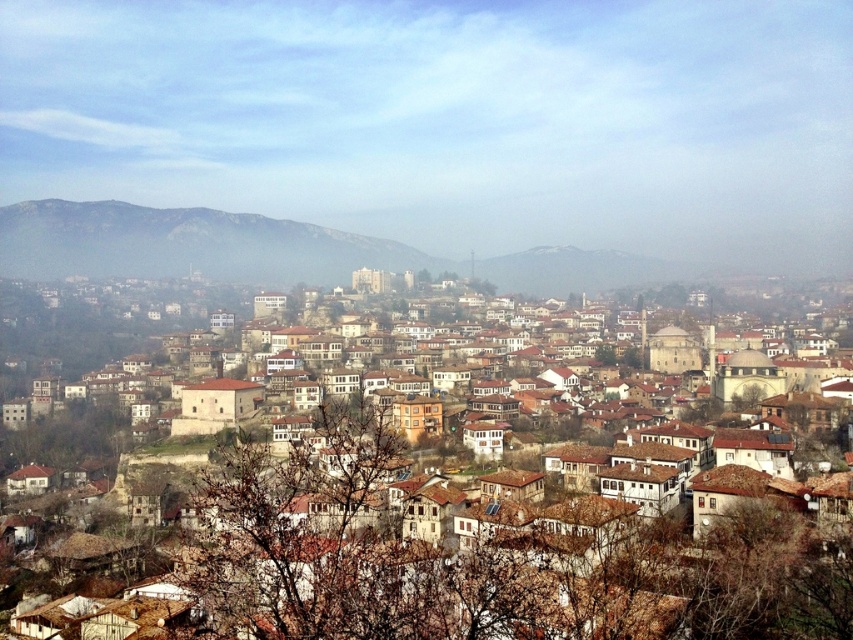
Between point (511, 545) and point (4, 269), which one is positioned behind?

Point (4, 269)

Which is in front, point (247, 532) or point (86, 264)?

Point (247, 532) is more forward.

Does point (764, 532) come farther from viewer compared to point (3, 253)?

No, it is not.

You are a GUI agent. You are given a task and a screenshot of the screen. Output one action in this format:
    pyautogui.click(x=<x>, y=<y>)
    Task: Click on the brown stone buildings at center
    Image resolution: width=853 pixels, height=640 pixels.
    Given the screenshot: What is the action you would take?
    pyautogui.click(x=508, y=564)